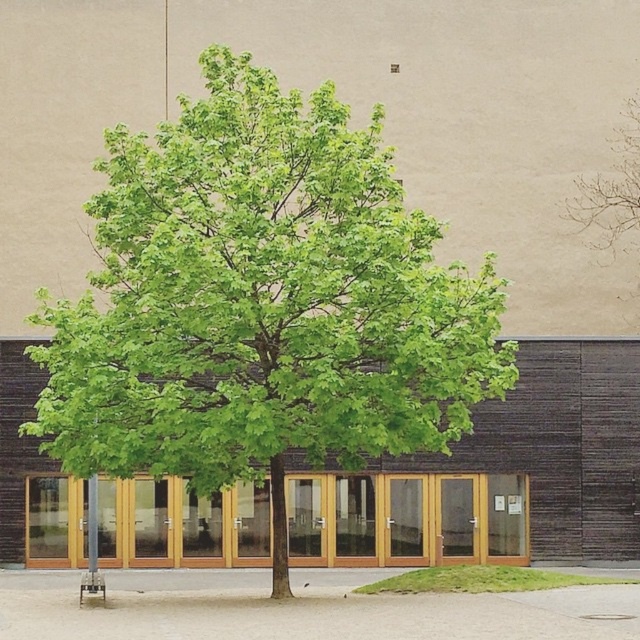
You are standing in front of the modern building and see the point marked at coordinates (260, 304). Based on the scene description, can you determine which object this point is located on?

The point at coordinates (260, 304) is located on the green leafy tree at center.

You are standing at the entrance of the building and want to walk towards the point labeled as point (589,198). However, there is an obstacle at point (257,68). Will you encounter this obstacle before reaching your destination?

Yes, you will encounter the obstacle at point (257,68) before reaching point (589,198) because point (257,68) is in front of point (589,198).